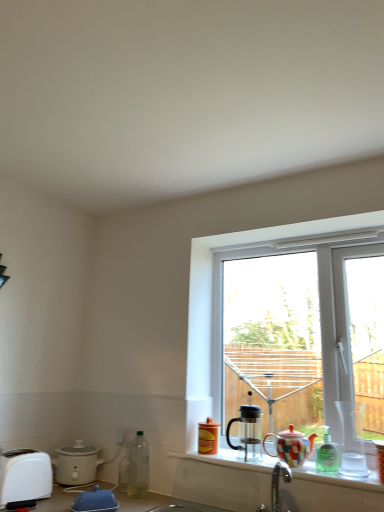
Identify the location of vacant area that lies to the right of orange matte bottle at window, which appears as the second bottle when viewed from the right. (246, 451).